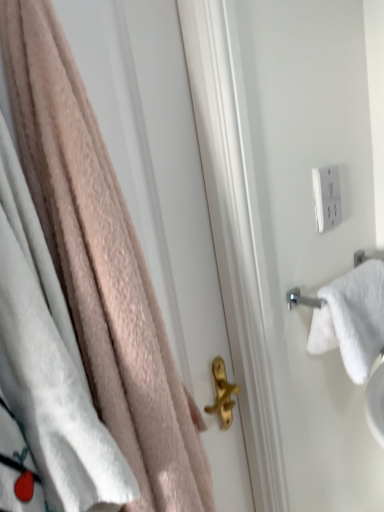
Question: Is soft pink towel at left, which appears as the second towel when viewed from the back, completely or partially outside of white cotton towel at right, which is counted as the second towel, starting from the front?

Choices:
 (A) yes
 (B) no

Answer: (A)

Question: Is soft pink towel at left, which appears as the first towel when viewed from the left, closer to the viewer compared to white cotton towel at right, marked as the 1th towel in a right-to-left arrangement?

Choices:
 (A) no
 (B) yes

Answer: (B)

Question: Does soft pink towel at left, marked as the 2th towel in a right-to-left arrangement, have a greater height compared to white cotton towel at right, positioned as the 2th towel in left-to-right order?

Choices:
 (A) no
 (B) yes

Answer: (B)

Question: Does soft pink towel at left, marked as the 2th towel in a right-to-left arrangement, appear on the right side of white cotton towel at right, which is counted as the second towel, starting from the front?

Choices:
 (A) yes
 (B) no

Answer: (B)

Question: Is soft pink towel at left, marked as the 2th towel in a right-to-left arrangement, facing towards white cotton towel at right, acting as the 1th towel starting from the back?

Choices:
 (A) yes
 (B) no

Answer: (B)

Question: Can you confirm if soft pink towel at left, which appears as the first towel when viewed from the left, is thinner than white cotton towel at right, acting as the 1th towel starting from the back?

Choices:
 (A) no
 (B) yes

Answer: (A)

Question: Is soft pink towel at left, marked as the 2th towel in a right-to-left arrangement, outside white plastic outlet at upper right?

Choices:
 (A) yes
 (B) no

Answer: (A)

Question: From a real-world perspective, is soft pink towel at left, which appears as the first towel when viewed from the left, below white plastic outlet at upper right?

Choices:
 (A) no
 (B) yes

Answer: (B)

Question: Considering the relative sizes of soft pink towel at left, which appears as the first towel when viewed from the left, and white plastic outlet at upper right in the image provided, is soft pink towel at left, which appears as the first towel when viewed from the left, smaller than white plastic outlet at upper right?

Choices:
 (A) yes
 (B) no

Answer: (B)

Question: Is soft pink towel at left, which appears as the first towel when viewed from the left, touching white plastic outlet at upper right?

Choices:
 (A) no
 (B) yes

Answer: (A)

Question: Does soft pink towel at left, which appears as the second towel when viewed from the back, have a greater width compared to white plastic outlet at upper right?

Choices:
 (A) yes
 (B) no

Answer: (A)

Question: Is soft pink towel at left, marked as the 2th towel in a right-to-left arrangement, positioned behind white plastic outlet at upper right?

Choices:
 (A) no
 (B) yes

Answer: (A)

Question: Is white cotton towel at right, marked as the 1th towel in a right-to-left arrangement, at the left side of soft pink towel at left, which appears as the first towel when viewed from the left?

Choices:
 (A) yes
 (B) no

Answer: (B)